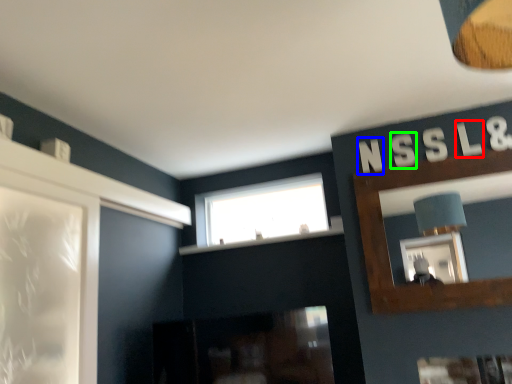
Question: Based on their relative distances, which object is nearer to letter (highlighted by a red box)? Choose from letter (highlighted by a blue box) and letter (highlighted by a green box).

Choices:
 (A) letter
 (B) letter

Answer: (B)